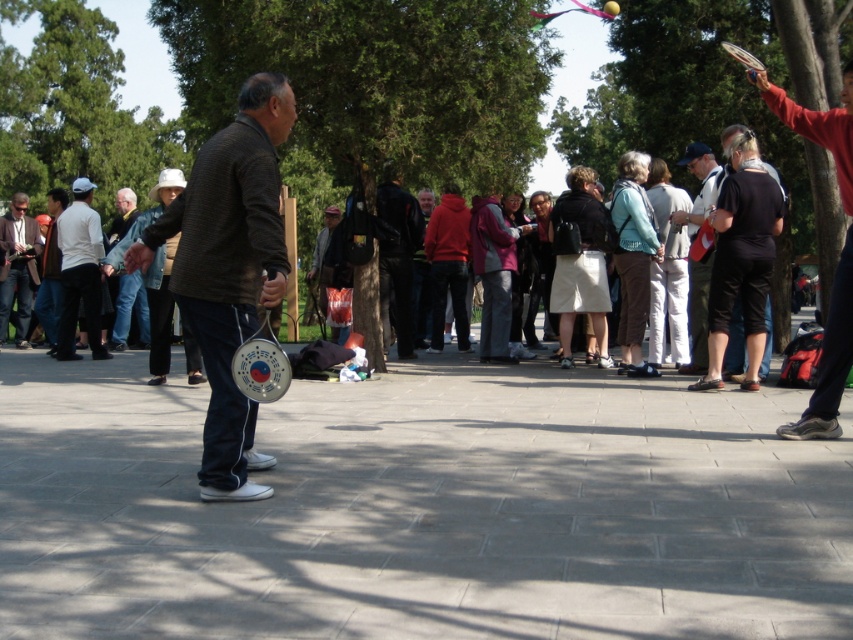
Where is the dark gray sweater at center located in terms of coordinates?

The dark gray sweater at center is located at coordinates point (229, 269).